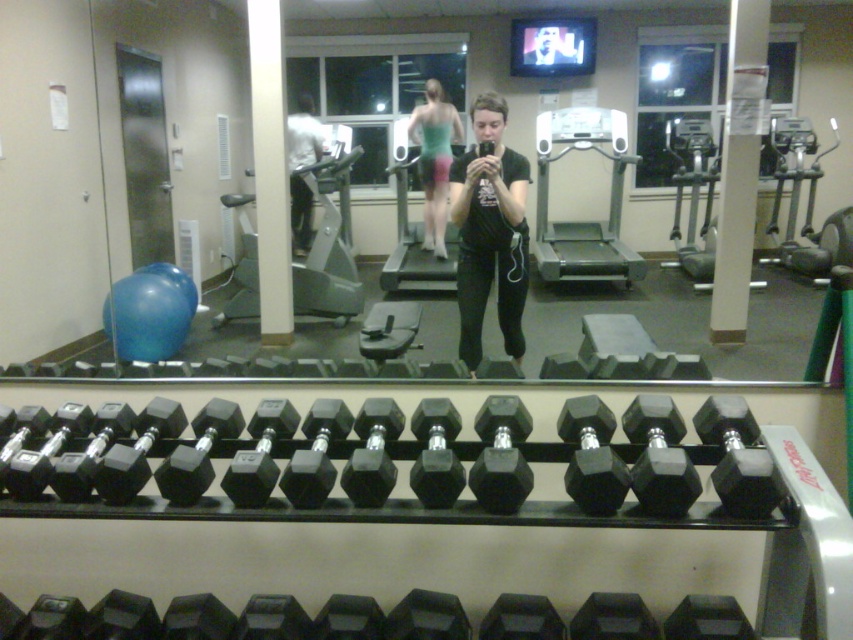
Is black rubber dumbbell at center taller than teal matte tank top at center?

Incorrect, black rubber dumbbell at center's height is not larger of teal matte tank top at center's.

Where is `black rubber dumbbell at center`? black rubber dumbbell at center is located at coordinates (390, 464).

What do you see at coordinates (489, 230) in the screenshot? I see `black matte shirt at center` at bounding box center [489, 230].

How distant is black matte shirt at center from teal matte tank top at center?

They are 3.77 meters apart.

What do you see at coordinates (489, 230) in the screenshot?
I see `black matte shirt at center` at bounding box center [489, 230].

At what (x,y) coordinates should I click in order to perform the action: click on black matte shirt at center. Please return your answer as a coordinate pair (x, y). The image size is (853, 640). Looking at the image, I should click on (489, 230).

Which is above, black hexagonal dumbbell at center or teal matte tank top at center?

Positioned higher is teal matte tank top at center.

Does black hexagonal dumbbell at center have a larger size compared to teal matte tank top at center?

Incorrect, black hexagonal dumbbell at center is not larger than teal matte tank top at center.

Identify the location of black hexagonal dumbbell at center. The width and height of the screenshot is (853, 640). (235, 618).

You are a GUI agent. You are given a task and a screenshot of the screen. Output one action in this format:
    pyautogui.click(x=<x>, y=<y>)
    Task: Click on the black hexagonal dumbbell at center
    The image size is (853, 640).
    Given the screenshot: What is the action you would take?
    pyautogui.click(x=235, y=618)